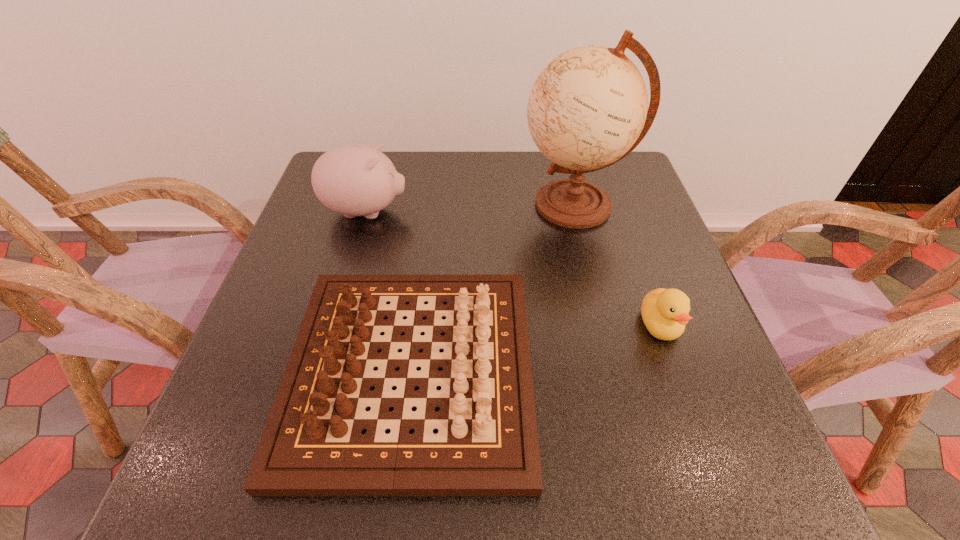
Where is `globe that is at the far edge`? globe that is at the far edge is located at coordinates (588, 108).

Locate an element on the screen. This screenshot has width=960, height=540. piggy bank located at the far edge is located at coordinates (354, 180).

The height and width of the screenshot is (540, 960). I want to click on object that is at the near edge, so click(x=487, y=446).

Where is `piggy bank situated at the left edge`? The image size is (960, 540). piggy bank situated at the left edge is located at coordinates point(354,180).

I want to click on gameboard at the left edge, so click(487, 446).

Where is `globe situated at the right edge`? The image size is (960, 540). globe situated at the right edge is located at coordinates (588, 108).

The width and height of the screenshot is (960, 540). I want to click on duckling that is at the right edge, so click(664, 312).

Where is `object at the far left corner`? The height and width of the screenshot is (540, 960). object at the far left corner is located at coordinates (354, 180).

Locate an element on the screen. object present at the near left corner is located at coordinates (487, 446).

This screenshot has width=960, height=540. In order to click on object located in the far right corner section of the desktop in this screenshot , I will do `click(588, 108)`.